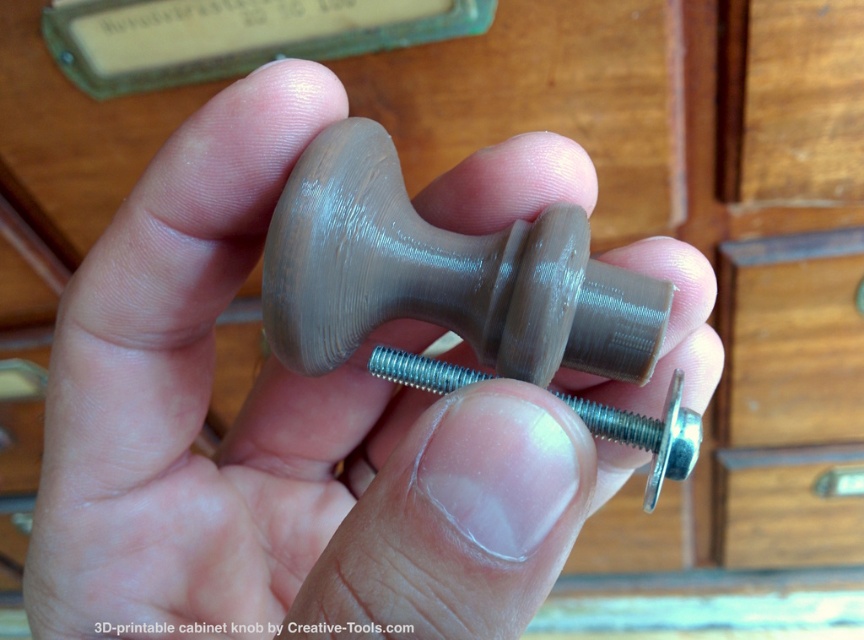
Question: Can you confirm if matte brown knob at center is positioned below satin silver metallic bolt at center?

Choices:
 (A) no
 (B) yes

Answer: (A)

Question: Which object appears farthest from the camera in this image?

Choices:
 (A) satin silver metallic bolt at center
 (B) matte brown knob at center

Answer: (A)

Question: Does matte brown knob at center appear under satin silver metallic bolt at center?

Choices:
 (A) yes
 (B) no

Answer: (B)

Question: From the image, what is the correct spatial relationship of matte brown knob at center in relation to satin silver metallic bolt at center?

Choices:
 (A) above
 (B) below

Answer: (A)

Question: Which object appears farthest from the camera in this image?

Choices:
 (A) satin silver metallic bolt at center
 (B) matte brown knob at center

Answer: (A)